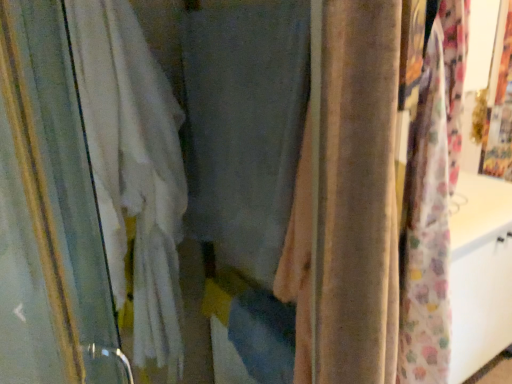
Image resolution: width=512 pixels, height=384 pixels. What do you see at coordinates (347, 200) in the screenshot?
I see `velvet beige curtain at center, which is the 3th curtain from left to right` at bounding box center [347, 200].

The image size is (512, 384). I want to click on matte gray curtain at center, arranged as the 2th curtain when viewed from the right, so click(x=245, y=128).

From a real-world perspective, which is physically below, velvet beige curtain at center, which is the 3th curtain from left to right, or matte gray curtain at center, arranged as the 2th curtain when viewed from the right?

velvet beige curtain at center, which is the 3th curtain from left to right.

Is velvet beige curtain at center, which is the 3th curtain from left to right, directly adjacent to matte gray curtain at center, arranged as the 2th curtain when viewed from the right?

No, velvet beige curtain at center, which is the 3th curtain from left to right, is not making contact with matte gray curtain at center, arranged as the 2th curtain when viewed from the right.

Looking at this image, could you tell me if velvet beige curtain at center, the first curtain from the right, is turned towards matte gray curtain at center, which is the 2th curtain in left-to-right order?

No, velvet beige curtain at center, the first curtain from the right, is not oriented towards matte gray curtain at center, which is the 2th curtain in left-to-right order.

From the image's perspective, is velvet beige curtain at center, which is the 3th curtain from left to right, above or below matte gray curtain at center, arranged as the 2th curtain when viewed from the right?

From the image's perspective, velvet beige curtain at center, which is the 3th curtain from left to right, appears below matte gray curtain at center, arranged as the 2th curtain when viewed from the right.

From the picture: From the image's perspective, would you say velvet beige curtain at center, the first curtain from the right, is shown under white fabric curtain at left, placed as the 3th curtain when sorted from right to left?

Actually, velvet beige curtain at center, the first curtain from the right, appears above white fabric curtain at left, placed as the 3th curtain when sorted from right to left, in the image.

Could you tell me if velvet beige curtain at center, the first curtain from the right, is facing white fabric curtain at left, placed as the 3th curtain when sorted from right to left?

No.

Starting from the white fabric curtain at left, which is the 1th curtain from left to right, which curtain is the 2nd one to the right? Please provide its 2D coordinates.

[(347, 200)]

Is matte gray curtain at center, arranged as the 2th curtain when viewed from the right, bigger or smaller than white fabric curtain at left, placed as the 3th curtain when sorted from right to left?

matte gray curtain at center, arranged as the 2th curtain when viewed from the right, is smaller than white fabric curtain at left, placed as the 3th curtain when sorted from right to left.

Is white fabric curtain at left, placed as the 3th curtain when sorted from right to left, at the back of matte gray curtain at center, which is the 2th curtain in left-to-right order?

No, matte gray curtain at center, which is the 2th curtain in left-to-right order, is not facing away from white fabric curtain at left, placed as the 3th curtain when sorted from right to left.

Which is nearer, (x=223, y=227) or (x=20, y=130)?

Point (x=223, y=227) appears to be farther away from the viewer than point (x=20, y=130).

Looking at the image, does white fabric curtain at left, which is the 1th curtain from left to right, seem bigger or smaller compared to velvet beige curtain at center, which is the 3th curtain from left to right?

Clearly, white fabric curtain at left, which is the 1th curtain from left to right, is larger in size than velvet beige curtain at center, which is the 3th curtain from left to right.

Looking at this image, is velvet beige curtain at center, the first curtain from the right, inside white fabric curtain at left, which is the 1th curtain from left to right?

No.

Is white fabric curtain at left, which is the 1th curtain from left to right, oriented towards velvet beige curtain at center, which is the 3th curtain from left to right?

Yes, white fabric curtain at left, which is the 1th curtain from left to right, is aimed at velvet beige curtain at center, which is the 3th curtain from left to right.

Which is in front, point (54, 211) or point (188, 152)?

The point (54, 211) is in front.

The width and height of the screenshot is (512, 384). I want to click on the 2nd curtain below when counting from the matte gray curtain at center, arranged as the 2th curtain when viewed from the right (from the image's perspective), so click(49, 213).

Does white fabric curtain at left, which is the 1th curtain from left to right, touch matte gray curtain at center, which is the 2th curtain in left-to-right order?

There is a gap between white fabric curtain at left, which is the 1th curtain from left to right, and matte gray curtain at center, which is the 2th curtain in left-to-right order.

In terms of height, does white fabric curtain at left, which is the 1th curtain from left to right, look taller or shorter compared to matte gray curtain at center, arranged as the 2th curtain when viewed from the right?

Considering their sizes, white fabric curtain at left, which is the 1th curtain from left to right, has more height than matte gray curtain at center, arranged as the 2th curtain when viewed from the right.

Is matte gray curtain at center, which is the 2th curtain in left-to-right order, inside or outside of velvet beige curtain at center, the first curtain from the right?

matte gray curtain at center, which is the 2th curtain in left-to-right order, is spatially situated outside velvet beige curtain at center, the first curtain from the right.

Between matte gray curtain at center, arranged as the 2th curtain when viewed from the right, and velvet beige curtain at center, which is the 3th curtain from left to right, which one appears on the right side from the viewer's perspective?

velvet beige curtain at center, which is the 3th curtain from left to right.

Is matte gray curtain at center, arranged as the 2th curtain when viewed from the right, aimed at velvet beige curtain at center, which is the 3th curtain from left to right?

No, matte gray curtain at center, arranged as the 2th curtain when viewed from the right, is not turned towards velvet beige curtain at center, which is the 3th curtain from left to right.

From the image's perspective, starting from the matte gray curtain at center, which is the 2th curtain in left-to-right order, which curtain is the 1st one below? Please provide its 2D coordinates.

[(347, 200)]

From a real-world perspective, which curtain is the 1st one above the white fabric curtain at left, placed as the 3th curtain when sorted from right to left? Please provide its 2D coordinates.

[(347, 200)]

Based on their spatial positions, is velvet beige curtain at center, which is the 3th curtain from left to right, or matte gray curtain at center, arranged as the 2th curtain when viewed from the right, closer to white fabric curtain at left, which is the 1th curtain from left to right?

Based on the image, matte gray curtain at center, arranged as the 2th curtain when viewed from the right, appears to be nearer to white fabric curtain at left, which is the 1th curtain from left to right.

When comparing their distances from white fabric curtain at left, which is the 1th curtain from left to right, does matte gray curtain at center, arranged as the 2th curtain when viewed from the right, or velvet beige curtain at center, the first curtain from the right, seem further?

velvet beige curtain at center, the first curtain from the right, is positioned further to the anchor white fabric curtain at left, which is the 1th curtain from left to right.

When comparing their distances from matte gray curtain at center, arranged as the 2th curtain when viewed from the right, does white fabric curtain at left, which is the 1th curtain from left to right, or velvet beige curtain at center, the first curtain from the right, seem further?

The object further to matte gray curtain at center, arranged as the 2th curtain when viewed from the right, is white fabric curtain at left, which is the 1th curtain from left to right.

When comparing their distances from velvet beige curtain at center, the first curtain from the right, does matte gray curtain at center, arranged as the 2th curtain when viewed from the right, or white fabric curtain at left, placed as the 3th curtain when sorted from right to left, seem further?

Among the two, white fabric curtain at left, placed as the 3th curtain when sorted from right to left, is located further to velvet beige curtain at center, the first curtain from the right.

Estimate the real-world distances between objects in this image. Which object is closer to velvet beige curtain at center, which is the 3th curtain from left to right, white fabric curtain at left, placed as the 3th curtain when sorted from right to left, or matte gray curtain at center, arranged as the 2th curtain when viewed from the right?

matte gray curtain at center, arranged as the 2th curtain when viewed from the right, is closer to velvet beige curtain at center, which is the 3th curtain from left to right.

Based on their spatial positions, is velvet beige curtain at center, which is the 3th curtain from left to right, or white fabric curtain at left, which is the 1th curtain from left to right, closer to matte gray curtain at center, arranged as the 2th curtain when viewed from the right?

The object closer to matte gray curtain at center, arranged as the 2th curtain when viewed from the right, is velvet beige curtain at center, which is the 3th curtain from left to right.

Find the location of a particular element. This screenshot has height=384, width=512. curtain between white fabric curtain at left, placed as the 3th curtain when sorted from right to left, and velvet beige curtain at center, the first curtain from the right, in the horizontal direction is located at coordinates (245, 128).